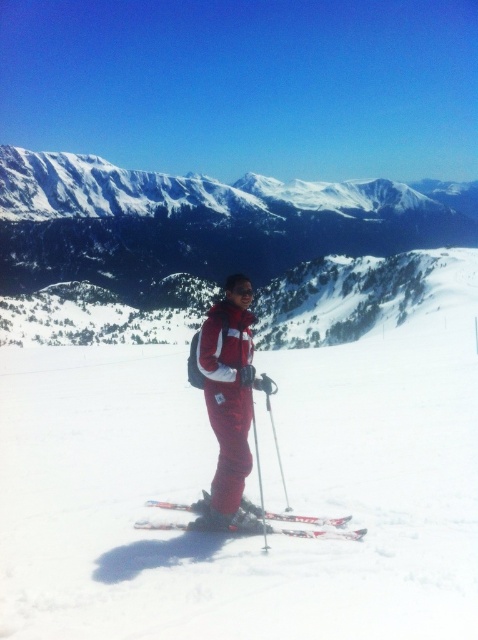
Does white matte snow at center have a lesser height compared to snowy mountain at center?

Indeed, white matte snow at center has a lesser height compared to snowy mountain at center.

Does white matte snow at center have a lesser width compared to snowy mountain at center?

Correct, white matte snow at center's width is less than snowy mountain at center's.

This screenshot has height=640, width=478. What do you see at coordinates (284, 472) in the screenshot?
I see `white matte snow at center` at bounding box center [284, 472].

Locate an element on the screen. white matte snow at center is located at coordinates (284, 472).

Is snowy mountain at center shorter than metallic skis at center?

No, snowy mountain at center is not shorter than metallic skis at center.

Does snowy mountain at center have a smaller size compared to metallic skis at center?

Actually, snowy mountain at center might be larger than metallic skis at center.

This screenshot has height=640, width=478. Identify the location of snowy mountain at center. point(217,253).

Measure the distance between white matte snow at center and camera.

They are 25.24 meters apart.

Who is shorter, white matte snow at center or metallic skis at center?

With less height is metallic skis at center.

Locate an element on the screen. This screenshot has height=640, width=478. white matte snow at center is located at coordinates (284, 472).

Identify the location of white matte snow at center. (284, 472).